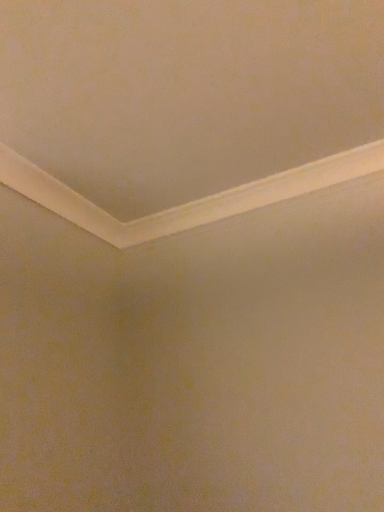
Describe the element at coordinates (186, 106) in the screenshot. This screenshot has width=384, height=512. I see `white matte baseboard at upper center` at that location.

Where is `white matte baseboard at upper center`? This screenshot has height=512, width=384. white matte baseboard at upper center is located at coordinates (186, 106).

Locate an element on the screen. white matte baseboard at upper center is located at coordinates (186, 106).